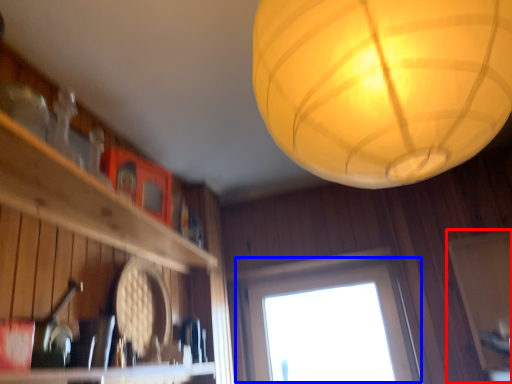
Question: Which of the following is the farthest to the observer, screen door (highlighted by a red box) or window (highlighted by a blue box)?

Choices:
 (A) screen door
 (B) window

Answer: (B)